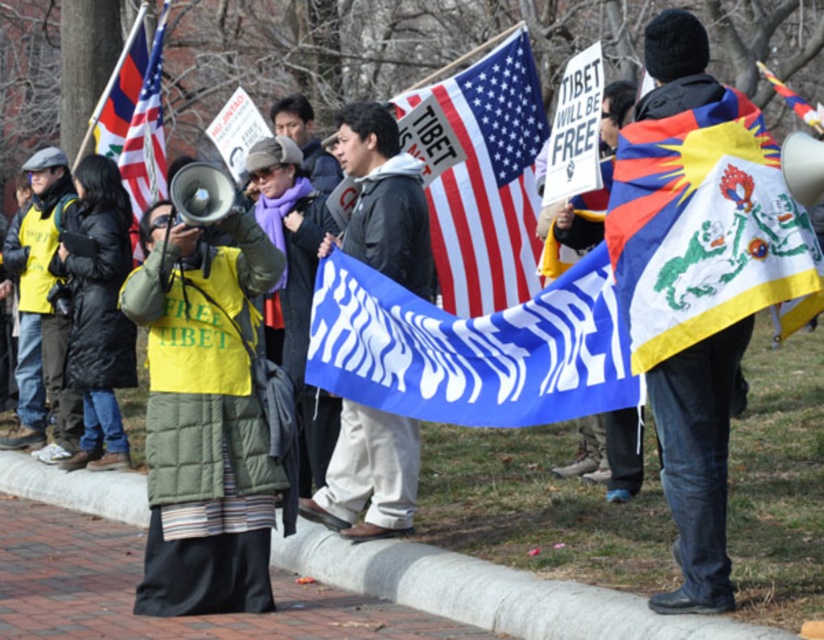
Which of these two, yellow fabric vest at left or matte black flag at upper left, stands taller?

yellow fabric vest at left

Is yellow fabric vest at left smaller than matte black flag at upper left?

Indeed, yellow fabric vest at left has a smaller size compared to matte black flag at upper left.

The height and width of the screenshot is (640, 824). In order to click on yellow fabric vest at left in this screenshot , I will do `click(97, 310)`.

This screenshot has height=640, width=824. In order to click on yellow fabric vest at left in this screenshot , I will do `click(97, 310)`.

Is embroidered silk flag at right to the right of white matte flag at center from the viewer's perspective?

Correct, you'll find embroidered silk flag at right to the right of white matte flag at center.

Can you confirm if embroidered silk flag at right is bigger than white matte flag at center?

Indeed, embroidered silk flag at right has a larger size compared to white matte flag at center.

Locate an element on the screen. The image size is (824, 640). embroidered silk flag at right is located at coordinates (705, 228).

Does blue fabric flag at center have a lesser width compared to embroidered silk flag at upper right?

Correct, blue fabric flag at center's width is less than embroidered silk flag at upper right's.

Does point (438, 388) lie behind point (771, 74)?

No, it is not.

This screenshot has height=640, width=824. Describe the element at coordinates (471, 349) in the screenshot. I see `blue fabric flag at center` at that location.

The height and width of the screenshot is (640, 824). Identify the location of blue fabric flag at center. [471, 349].